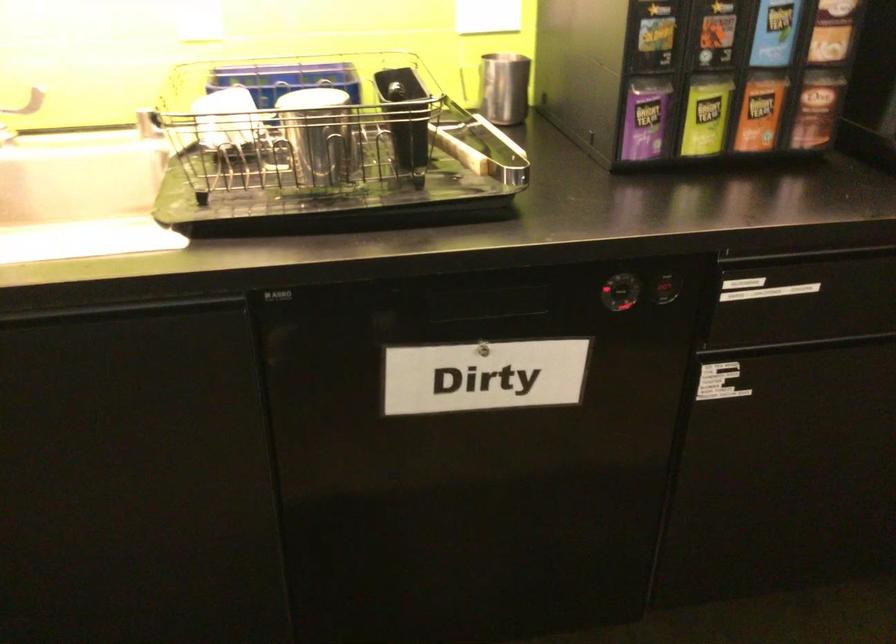
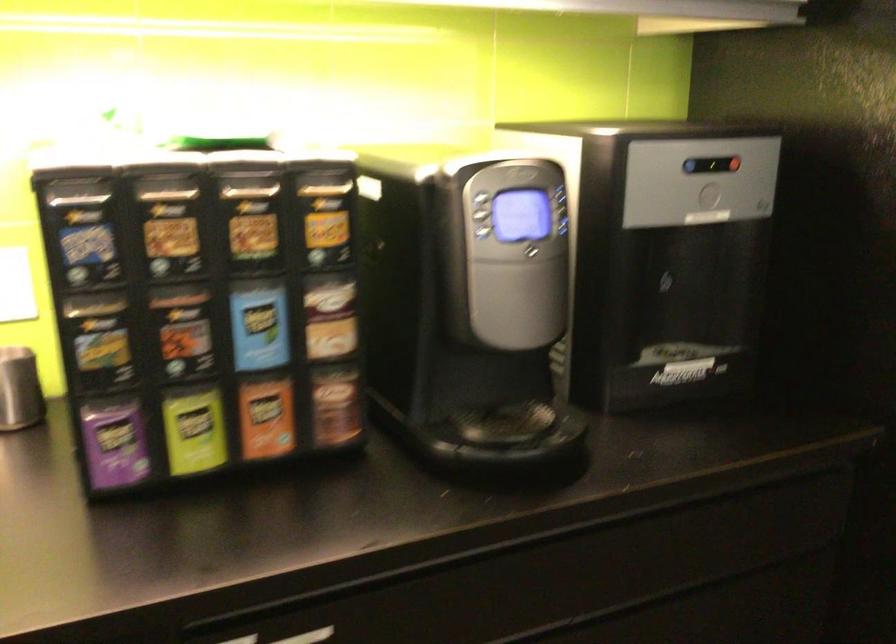
In the second image, find the point that corresponds to (x=705, y=116) in the first image.

(194, 430)